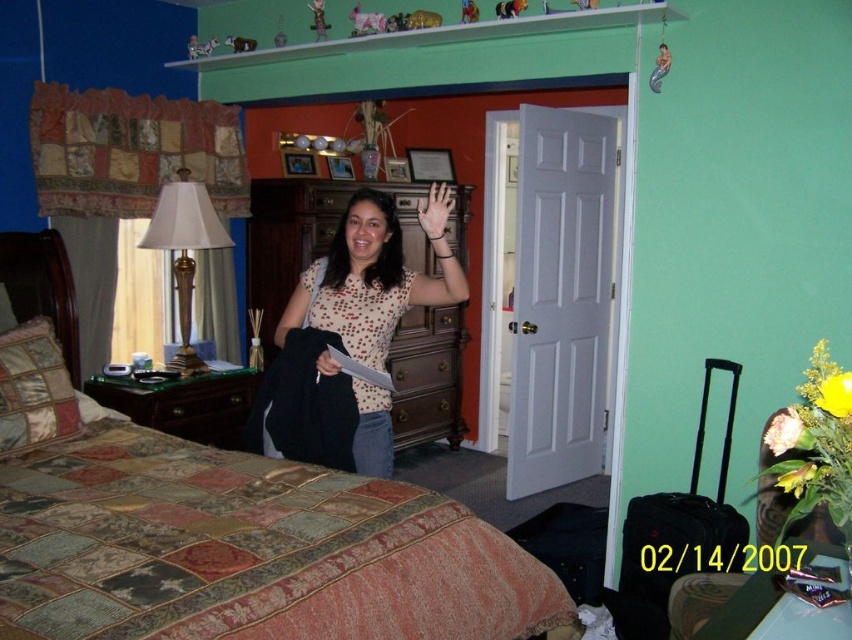
Question: Which point is farther from the camera taking this photo?

Choices:
 (A) (177, 292)
 (B) (338, 365)

Answer: (A)

Question: Can you confirm if patchwork quilted bed at center is bigger than smooth black hand at center?

Choices:
 (A) yes
 (B) no

Answer: (A)

Question: Can you confirm if patchwork quilted bed at center is thinner than polka dot blouse at center?

Choices:
 (A) no
 (B) yes

Answer: (A)

Question: Which point is closer to the camera?

Choices:
 (A) (426, 209)
 (B) (202, 192)
 (C) (29, 609)
 (D) (281, 330)

Answer: (C)

Question: Which point appears closest to the camera in this image?

Choices:
 (A) (12, 573)
 (B) (199, 196)
 (C) (442, 225)
 (D) (395, 227)

Answer: (A)

Question: Can you confirm if gold metallic lampshade at left is positioned to the left of smooth black hand at center?

Choices:
 (A) no
 (B) yes

Answer: (B)